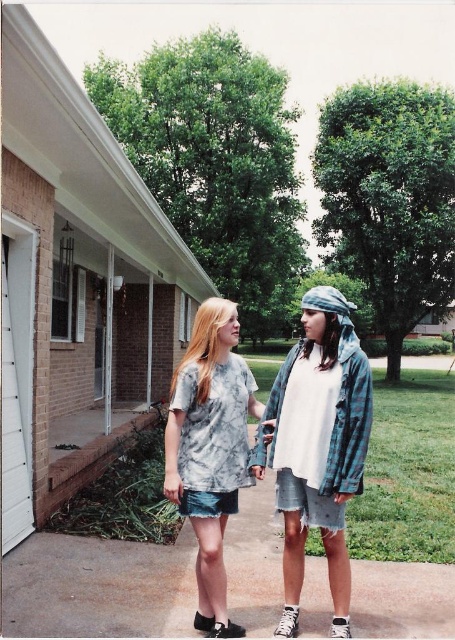
Who is more distant from viewer, (x=85, y=592) or (x=211, y=360)?

Positioned behind is point (x=85, y=592).

Between concrete pavement at lower center and tie-dye fabric shirt at center, which one has more height?

With more height is tie-dye fabric shirt at center.

I want to click on concrete pavement at lower center, so 97,588.

Between concrete pavement at lower center and tie-dye t-shirt at center, which one has more height?

tie-dye t-shirt at center is taller.

Is the position of concrete pavement at lower center more distant than that of tie-dye t-shirt at center?

Yes.

Is point (168, 604) positioned in front of point (252, 456)?

No, (168, 604) is further to viewer.

You are a GUI agent. You are given a task and a screenshot of the screen. Output one action in this format:
    pyautogui.click(x=<x>, y=<y>)
    Task: Click on the concrete pavement at lower center
    The image size is (455, 640).
    Given the screenshot: What is the action you would take?
    pyautogui.click(x=97, y=588)

Which of these two, tie-dye t-shirt at center or tie-dye fabric shirt at center, stands shorter?

tie-dye fabric shirt at center

Based on the photo, who is more forward, [289,433] or [181,404]?

Point [181,404] is in front.

Measure the distance between tie-dye t-shirt at center and camera.

The distance of tie-dye t-shirt at center from camera is 8.20 feet.

Image resolution: width=455 pixels, height=640 pixels. In order to click on tie-dye t-shirt at center in this screenshot , I will do `click(318, 445)`.